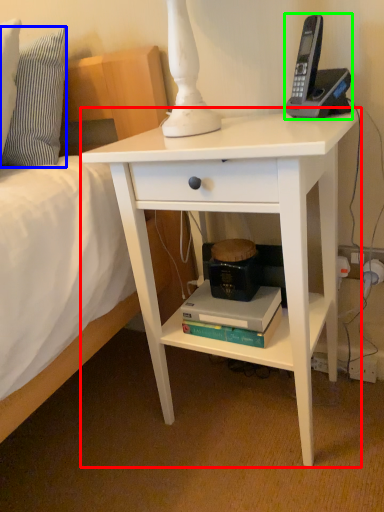
Question: Estimate the real-world distances between objects in this image. Which object is farther from desk (highlighted by a red box), pillow (highlighted by a blue box) or corded phone (highlighted by a green box)?

Choices:
 (A) pillow
 (B) corded phone

Answer: (A)